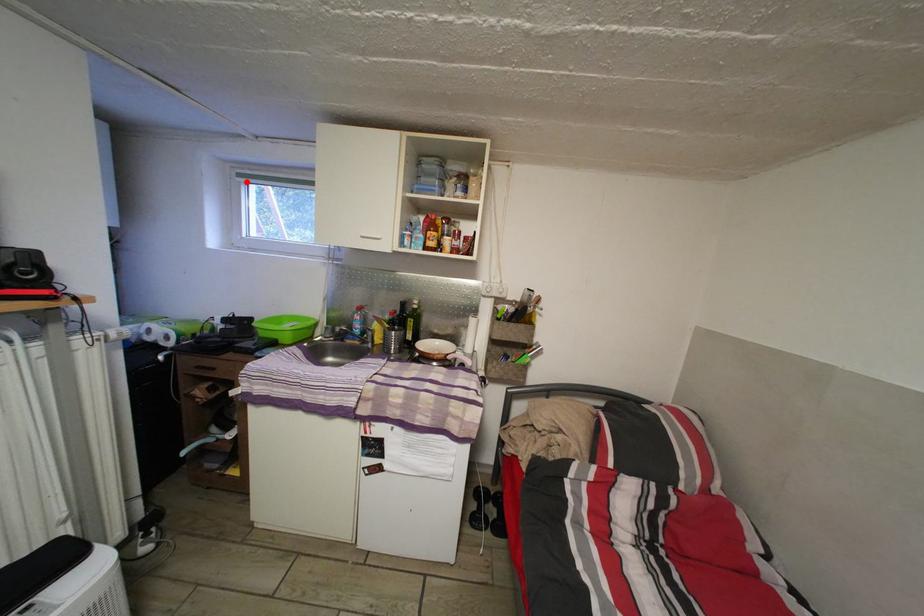
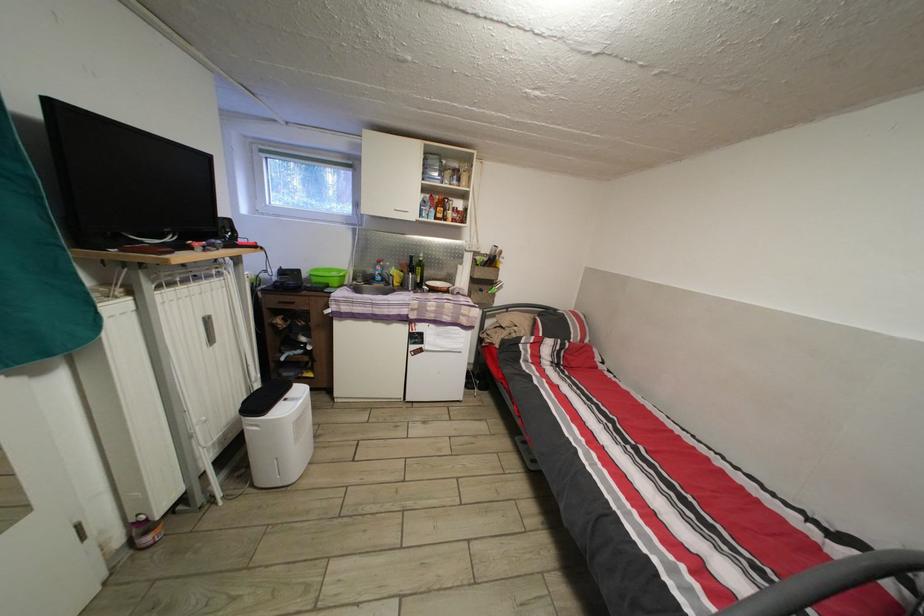
The point at the highlighted location is marked in the first image. Where is the corresponding point in the second image?

(269, 156)